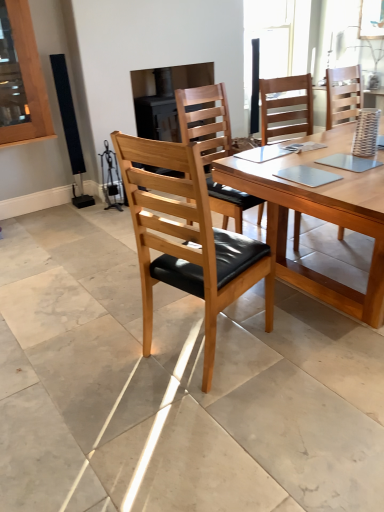
Describe the element at coordinates (268, 40) in the screenshot. I see `transparent glass window at upper center` at that location.

The width and height of the screenshot is (384, 512). Identify the location of transparent glass window at upper center. (268, 40).

Is wooden table at center smaller than wooden chair with black cushion at center, the second chair from the right?

No.

From the image's perspective, is wooden table at center above or below wooden chair with black cushion at center, the second chair from the right?

Based on their image positions, wooden table at center is located beneath wooden chair with black cushion at center, the second chair from the right.

Is wooden table at center oriented towards wooden chair with black cushion at center, the second chair from the right?

No.

Locate an element on the screen. the 2nd chair to the left when counting from the wooden table at center is located at coordinates (205, 121).

Is wooden table at center surrounded by transparent glass window at upper center?

That's incorrect, wooden table at center is not inside transparent glass window at upper center.

How different are the orientations of transparent glass window at upper center and wooden table at center in degrees?

There is a 89.6-degree angle between the facing directions of transparent glass window at upper center and wooden table at center.

Based on the photo, does transparent glass window at upper center turn towards wooden table at center?

No, transparent glass window at upper center is not facing towards wooden table at center.

From a real-world perspective, is transparent glass window at upper center on top of wooden table at center?

Yes, from a real-world perspective, transparent glass window at upper center is on top of wooden table at center.

Consider the image. Considering the relative sizes of natural wood/black leather chair at center, the third chair in the right-to-left sequence, and light brown wood chair at center, marked as the third chair in a left-to-right arrangement, in the image provided, is natural wood/black leather chair at center, the third chair in the right-to-left sequence, taller than light brown wood chair at center, marked as the third chair in a left-to-right arrangement,?

Incorrect, the height of natural wood/black leather chair at center, the third chair in the right-to-left sequence, is not larger of that of light brown wood chair at center, marked as the third chair in a left-to-right arrangement.

Is light brown wood chair at center, marked as the third chair in a left-to-right arrangement, surrounded by natural wood/black leather chair at center, the third chair in the right-to-left sequence?

No, light brown wood chair at center, marked as the third chair in a left-to-right arrangement, is not inside natural wood/black leather chair at center, the third chair in the right-to-left sequence.

How much distance is there between natural wood/black leather chair at center, the first chair from the left, and light brown wood chair at center, the 1th chair in the right-to-left sequence?

The distance of natural wood/black leather chair at center, the first chair from the left, from light brown wood chair at center, the 1th chair in the right-to-left sequence, is 1.55 meters.

Is there a large distance between natural wood/black leather chair at center, the third chair in the right-to-left sequence, and light brown wood chair at center, marked as the third chair in a left-to-right arrangement?

Yes, natural wood/black leather chair at center, the third chair in the right-to-left sequence, and light brown wood chair at center, marked as the third chair in a left-to-right arrangement, are located far from each other.

From the image's perspective, is wooden table at center located beneath light brown wood chair at center, the 1th chair in the right-to-left sequence?

Yes, from the image's perspective, wooden table at center is beneath light brown wood chair at center, the 1th chair in the right-to-left sequence.

Considering the sizes of objects wooden table at center and light brown wood chair at center, the 1th chair in the right-to-left sequence, in the image provided, who is bigger, wooden table at center or light brown wood chair at center, the 1th chair in the right-to-left sequence,?

wooden table at center is bigger.

From a real-world perspective, who is located lower, wooden table at center or light brown wood chair at center, the 1th chair in the right-to-left sequence?

wooden table at center is physically lower.

Measure the distance between natural wood/black leather chair at center, the first chair from the left, and wooden chair with black cushion at center, the second chair from the right.

The distance of natural wood/black leather chair at center, the first chair from the left, from wooden chair with black cushion at center, the second chair from the right, is 30.02 inches.

Between natural wood/black leather chair at center, the third chair in the right-to-left sequence, and wooden chair with black cushion at center, the second chair viewed from the left, which one has less height?

With less height is wooden chair with black cushion at center, the second chair viewed from the left.

From the image's perspective, is natural wood/black leather chair at center, the first chair from the left, under wooden chair with black cushion at center, the second chair viewed from the left?

Indeed, from the image's perspective, natural wood/black leather chair at center, the first chair from the left, is shown beneath wooden chair with black cushion at center, the second chair viewed from the left.

Which is closer to the camera, (x=195, y=194) or (x=229, y=146)?

Positioned in front is point (x=195, y=194).

Is light brown wood chair at center, marked as the third chair in a left-to-right arrangement, at the left side of wooden chair with black cushion at center, the second chair from the right?

No, light brown wood chair at center, marked as the third chair in a left-to-right arrangement, is not to the left of wooden chair with black cushion at center, the second chair from the right.

Is light brown wood chair at center, marked as the third chair in a left-to-right arrangement, beside wooden chair with black cushion at center, the second chair viewed from the left?

light brown wood chair at center, marked as the third chair in a left-to-right arrangement, and wooden chair with black cushion at center, the second chair viewed from the left, are clearly separated.

Is light brown wood chair at center, marked as the third chair in a left-to-right arrangement, thinner than wooden chair with black cushion at center, the second chair viewed from the left?

No, light brown wood chair at center, marked as the third chair in a left-to-right arrangement, is not thinner than wooden chair with black cushion at center, the second chair viewed from the left.

Is light brown wood chair at center, the 1th chair in the right-to-left sequence, completely or partially outside of wooden chair with black cushion at center, the second chair viewed from the left?

Absolutely, light brown wood chair at center, the 1th chair in the right-to-left sequence, is external to wooden chair with black cushion at center, the second chair viewed from the left.

In terms of width, does wooden chair with black cushion at center, the second chair viewed from the left, look wider or thinner when compared to natural wood/black leather chair at center, the first chair from the left?

Considering their sizes, wooden chair with black cushion at center, the second chair viewed from the left, looks broader than natural wood/black leather chair at center, the first chair from the left.

Considering the sizes of wooden chair with black cushion at center, the second chair viewed from the left, and natural wood/black leather chair at center, the first chair from the left, in the image, is wooden chair with black cushion at center, the second chair viewed from the left, bigger or smaller than natural wood/black leather chair at center, the first chair from the left,?

In the image, wooden chair with black cushion at center, the second chair viewed from the left, appears to be smaller than natural wood/black leather chair at center, the first chair from the left.

Which is behind, point (261, 209) or point (258, 244)?

Positioned behind is point (261, 209).

Looking at this image, does wooden chair with black cushion at center, the second chair viewed from the left, touch natural wood/black leather chair at center, the third chair in the right-to-left sequence?

wooden chair with black cushion at center, the second chair viewed from the left, and natural wood/black leather chair at center, the third chair in the right-to-left sequence, are clearly separated.

The height and width of the screenshot is (512, 384). In order to click on the 2nd chair counting from the left side of the wooden table at center in this screenshot , I will do `click(205, 121)`.

You are a GUI agent. You are given a task and a screenshot of the screen. Output one action in this format:
    pyautogui.click(x=<x>, y=<y>)
    Task: Click on the window behind the wooden table at center
    
    Given the screenshot: What is the action you would take?
    pyautogui.click(x=268, y=40)

Estimate the real-world distances between objects in this image. Which object is closer to light brown wood chair at center, the 1th chair in the right-to-left sequence, wooden table at center or wooden chair with black cushion at center, the second chair viewed from the left?

wooden chair with black cushion at center, the second chair viewed from the left, is closer to light brown wood chair at center, the 1th chair in the right-to-left sequence.

Which object lies nearer to the anchor point wooden table at center, wooden chair with black cushion at center, the second chair from the right, or light brown wood chair at center, marked as the third chair in a left-to-right arrangement?

Among the two, wooden chair with black cushion at center, the second chair from the right, is located nearer to wooden table at center.

When comparing their distances from natural wood/black leather chair at center, the first chair from the left, does light brown wood chair at center, the 1th chair in the right-to-left sequence, or wooden table at center seem further?

Among the two, light brown wood chair at center, the 1th chair in the right-to-left sequence, is located further to natural wood/black leather chair at center, the first chair from the left.

From the image, which object appears to be nearer to transparent glass window at upper center, natural wood/black leather chair at center, the first chair from the left, or wooden chair with black cushion at center, the second chair from the right?

The object closer to transparent glass window at upper center is wooden chair with black cushion at center, the second chair from the right.

Based on their spatial positions, is transparent glass window at upper center or natural wood/black leather chair at center, the first chair from the left, further from light brown wood chair at center, the 1th chair in the right-to-left sequence?

transparent glass window at upper center.

Which object lies nearer to the anchor point natural wood/black leather chair at center, the first chair from the left, transparent glass window at upper center or wooden table at center?

The object closer to natural wood/black leather chair at center, the first chair from the left, is wooden table at center.

Based on their spatial positions, is natural wood/black leather chair at center, the first chair from the left, or light brown wood chair at center, marked as the third chair in a left-to-right arrangement, further from transparent glass window at upper center?

Based on the image, natural wood/black leather chair at center, the first chair from the left, appears to be further to transparent glass window at upper center.

Based on their spatial positions, is wooden chair with black cushion at center, the second chair from the right, or wooden table at center further from natural wood/black leather chair at center, the first chair from the left?

Based on the image, wooden chair with black cushion at center, the second chair from the right, appears to be further to natural wood/black leather chair at center, the first chair from the left.

The image size is (384, 512). I want to click on kitchen & dining room table between natural wood/black leather chair at center, the first chair from the left, and light brown wood chair at center, the 1th chair in the right-to-left sequence, from front to back, so click(319, 217).

This screenshot has height=512, width=384. Find the location of `kitchen & dining room table located between natural wood/black leather chair at center, the third chair in the right-to-left sequence, and transparent glass window at upper center in the depth direction`. kitchen & dining room table located between natural wood/black leather chair at center, the third chair in the right-to-left sequence, and transparent glass window at upper center in the depth direction is located at coordinates (319, 217).

The height and width of the screenshot is (512, 384). What are the coordinates of `chair positioned between natural wood/black leather chair at center, the third chair in the right-to-left sequence, and light brown wood chair at center, the 1th chair in the right-to-left sequence, from near to far` in the screenshot? It's located at (205, 121).

Locate an element on the screen. The image size is (384, 512). chair between wooden chair with black cushion at center, the second chair from the right, and transparent glass window at upper center, along the z-axis is located at coordinates (286, 105).